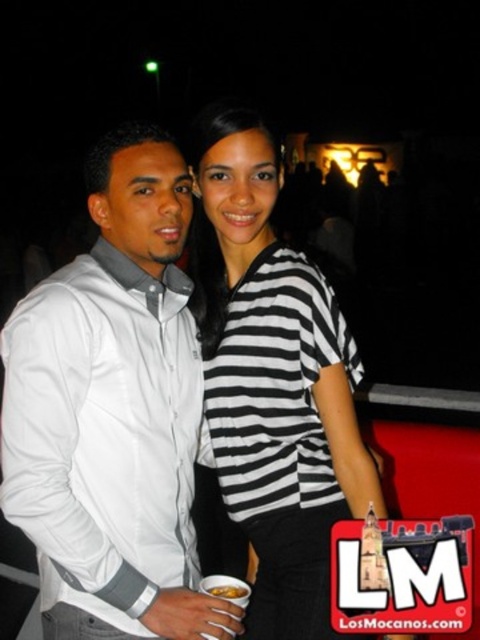
Question: Is white matte shirt at center bigger than black and white striped shirt at center?

Choices:
 (A) no
 (B) yes

Answer: (B)

Question: Can you confirm if white matte shirt at center is positioned to the left of black and white striped shirt at center?

Choices:
 (A) yes
 (B) no

Answer: (A)

Question: Considering the relative positions of white matte shirt at center and black and white striped shirt at center in the image provided, where is white matte shirt at center located with respect to black and white striped shirt at center?

Choices:
 (A) left
 (B) right

Answer: (A)

Question: Which point is farther to the camera?

Choices:
 (A) (330, 371)
 (B) (136, 470)

Answer: (A)

Question: Which point is closer to the camera taking this photo?

Choices:
 (A) (351, 401)
 (B) (99, 220)

Answer: (B)